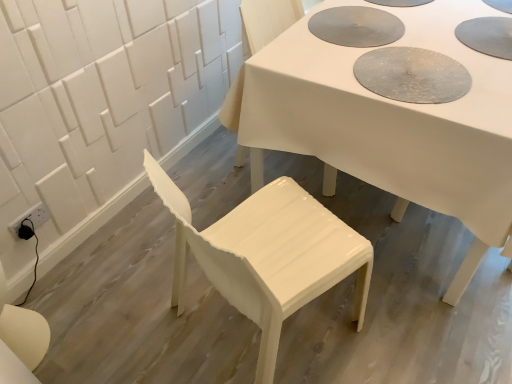
Question: Is white glossy chair at center, the second chair positioned from the bottom, to the right of glossy white chair at lower center, the first chair when ordered from front to back, from the viewer's perspective?

Choices:
 (A) no
 (B) yes

Answer: (B)

Question: Does white glossy chair at center, which ranks as the 1th chair in back-to-front order, have a lesser height compared to glossy white chair at lower center, which is the 1th chair from bottom to top?

Choices:
 (A) no
 (B) yes

Answer: (A)

Question: Does white glossy chair at center, which ranks as the 1th chair in back-to-front order, have a greater width compared to glossy white chair at lower center, the first chair when ordered from front to back?

Choices:
 (A) yes
 (B) no

Answer: (B)

Question: From a real-world perspective, does white glossy chair at center, the second chair in the front-to-back sequence, stand above glossy white chair at lower center, the second chair viewed from the back?

Choices:
 (A) yes
 (B) no

Answer: (A)

Question: From a real-world perspective, is white glossy chair at center, the second chair in the front-to-back sequence, beneath glossy white chair at lower center, the second chair viewed from the back?

Choices:
 (A) no
 (B) yes

Answer: (A)

Question: From a real-world perspective, is glossy white chair at lower center, acting as the 2th chair starting from the top, above or below white glossy chair at center, which ranks as the 1th chair in back-to-front order?

Choices:
 (A) below
 (B) above

Answer: (A)

Question: Is glossy white chair at lower center, the first chair when ordered from front to back, inside the boundaries of white glossy chair at center, which ranks as the first chair in top-to-bottom order, or outside?

Choices:
 (A) outside
 (B) inside

Answer: (A)

Question: In terms of width, does glossy white chair at lower center, the first chair when ordered from front to back, look wider or thinner when compared to white glossy chair at center, the second chair in the front-to-back sequence?

Choices:
 (A) thin
 (B) wide

Answer: (B)

Question: Is point (254, 205) positioned closer to the camera than point (329, 172)?

Choices:
 (A) farther
 (B) closer

Answer: (B)

Question: Is white glossy chair at center, which ranks as the 1th chair in back-to-front order, wider or thinner than white glossy table at center?

Choices:
 (A) thin
 (B) wide

Answer: (A)

Question: Is white glossy chair at center, which ranks as the 1th chair in back-to-front order, inside the boundaries of white glossy table at center, or outside?

Choices:
 (A) outside
 (B) inside

Answer: (A)

Question: From a real-world perspective, is white glossy chair at center, the second chair in the front-to-back sequence, physically located above or below white glossy table at center?

Choices:
 (A) above
 (B) below

Answer: (A)

Question: Considering the positions of white glossy chair at center, the second chair positioned from the bottom, and white glossy table at center in the image, is white glossy chair at center, the second chair positioned from the bottom, taller or shorter than white glossy table at center?

Choices:
 (A) short
 (B) tall

Answer: (B)

Question: Does point (480, 67) appear closer or farther from the camera than point (251, 11)?

Choices:
 (A) closer
 (B) farther

Answer: (A)

Question: Considering the positions of white glossy table at center and white glossy chair at center, which ranks as the 1th chair in back-to-front order, in the image, is white glossy table at center bigger or smaller than white glossy chair at center, which ranks as the 1th chair in back-to-front order,?

Choices:
 (A) big
 (B) small

Answer: (A)